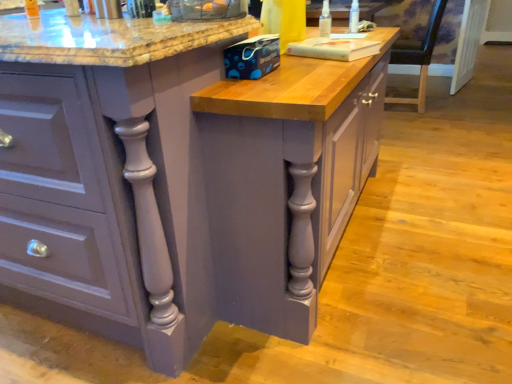
This screenshot has width=512, height=384. In order to click on unoccupied area in front of wooden chair at right in this screenshot , I will do `click(419, 123)`.